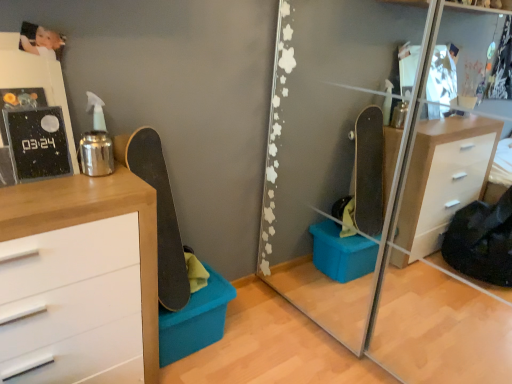
Question: Is white glossy picture frame at upper left in front of or behind smooth black skateboard at left in the image?

Choices:
 (A) behind
 (B) front

Answer: (B)

Question: From their relative heights in the image, would you say white glossy picture frame at upper left is taller or shorter than smooth black skateboard at left?

Choices:
 (A) short
 (B) tall

Answer: (A)

Question: Which object is positioned farthest from the smooth black skateboard at left?

Choices:
 (A) white glossy picture frame at upper left
 (B) wooden chest of drawers at left
 (C) transparent glass mirror at center
 (D) matte blue plastic storage box at lower center

Answer: (C)

Question: Which is farther from the smooth black skateboard at left?

Choices:
 (A) matte blue plastic storage box at lower center
 (B) white glossy picture frame at upper left
 (C) wooden chest of drawers at left
 (D) transparent glass mirror at center

Answer: (D)